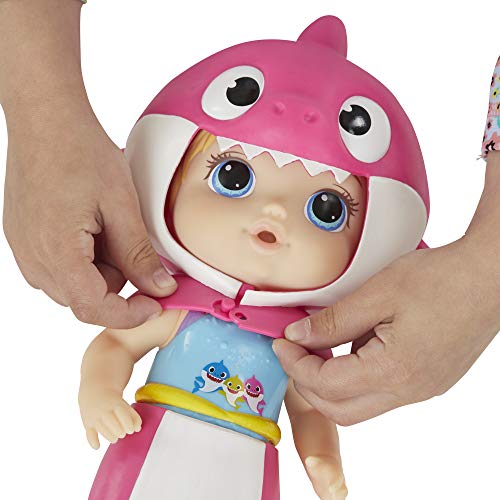
The width and height of the screenshot is (500, 500). In order to click on doll in this screenshot , I will do `click(288, 272)`.